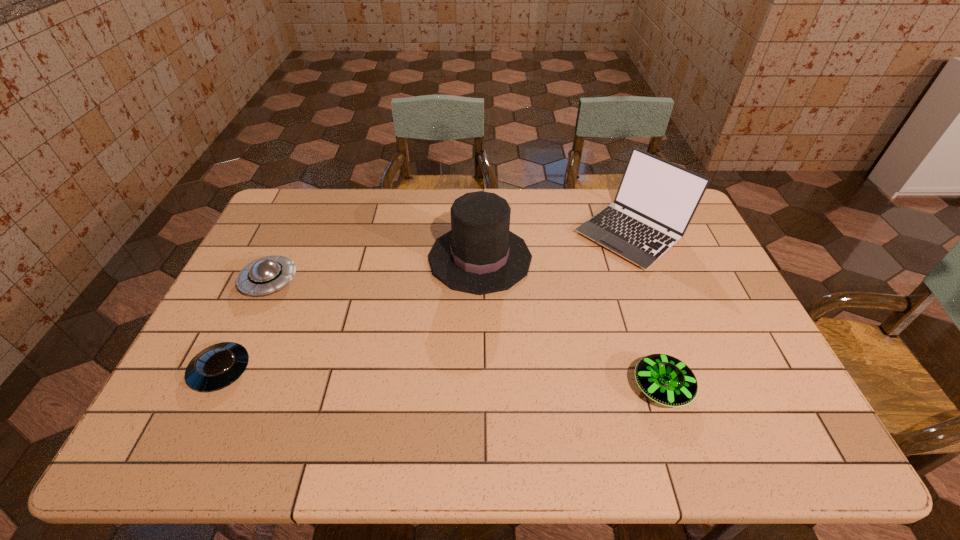
At what (x,y) coordinates should I click in order to perform the action: click on vacant position in the image that satisfies the following two spatial constraints: 1. at the front screen of the laptop_computer; 2. on the front side of the rightmost saucer. Please return your answer as a coordinate pair (x, y). The image size is (960, 540). Looking at the image, I should click on (690, 387).